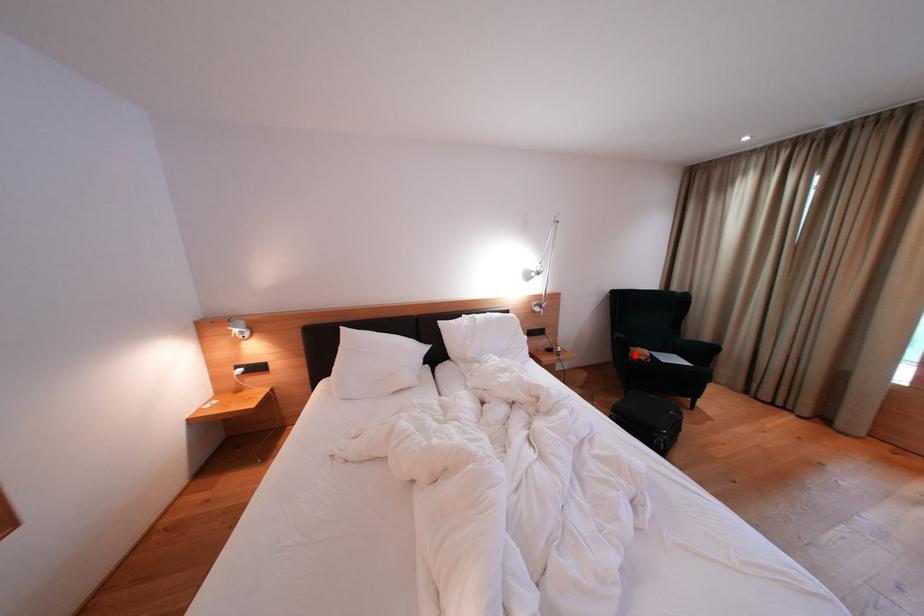
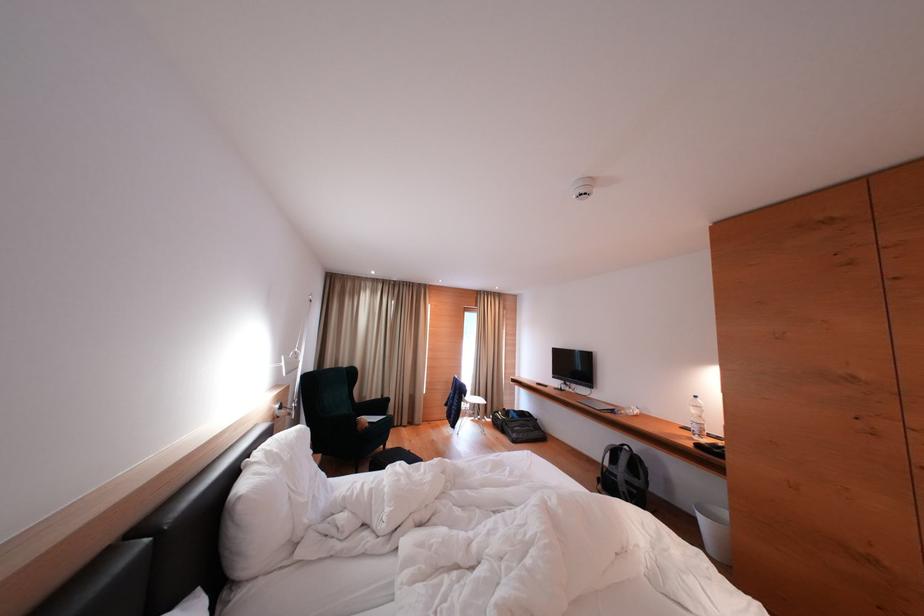
Question: I am providing you with two images of the same scene from different viewpoints. Image1 has a red point marked. In image2, the corresponding 3D location appears at what relative position? Reply with the corresponding letter.

Choices:
 (A) Closer
 (B) Farther

Answer: (B)